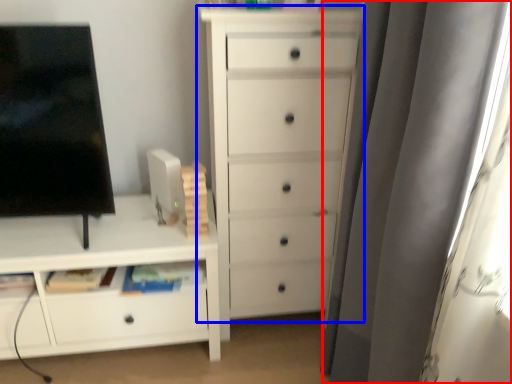
Question: Which object is closer to the camera taking this photo, curtain (highlighted by a red box) or chest of drawers (highlighted by a blue box)?

Choices:
 (A) curtain
 (B) chest of drawers

Answer: (A)